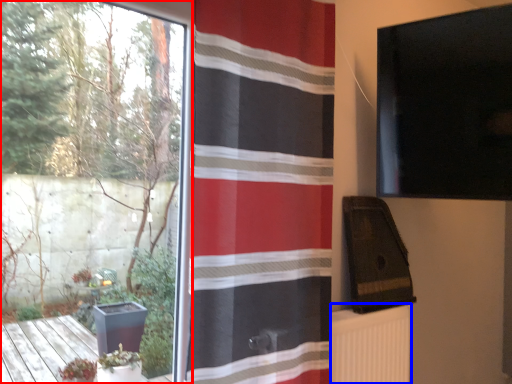
Question: Which of the following is the farthest to the observer, window (highlighted by a red box) or radiator (highlighted by a blue box)?

Choices:
 (A) window
 (B) radiator

Answer: (B)